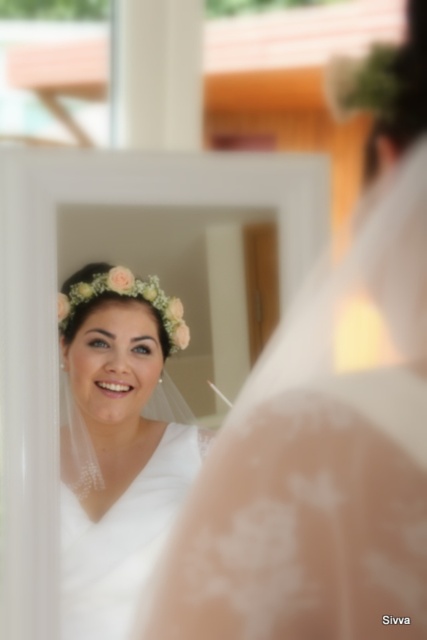
Question: Which point is farther from the camera taking this photo?

Choices:
 (A) (306, 570)
 (B) (131, 352)

Answer: (B)

Question: Does white lace veil at upper left appear over white lace dress at center?

Choices:
 (A) yes
 (B) no

Answer: (A)

Question: From the image, what is the correct spatial relationship of white lace veil at upper left in relation to white lace dress at center?

Choices:
 (A) above
 (B) below

Answer: (A)

Question: Does white lace veil at upper left have a lesser width compared to white lace dress at center?

Choices:
 (A) yes
 (B) no

Answer: (B)

Question: Which of the following is the farthest from the observer?

Choices:
 (A) white lace dress at center
 (B) white lace veil at upper left

Answer: (A)